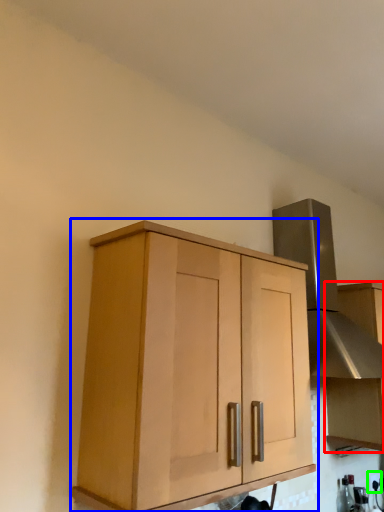
Question: Considering the real-world distances, which object is closest to cabinetry (highlighted by a red box)? cabinetry (highlighted by a blue box) or electric outlet (highlighted by a green box).

Choices:
 (A) cabinetry
 (B) electric outlet

Answer: (B)